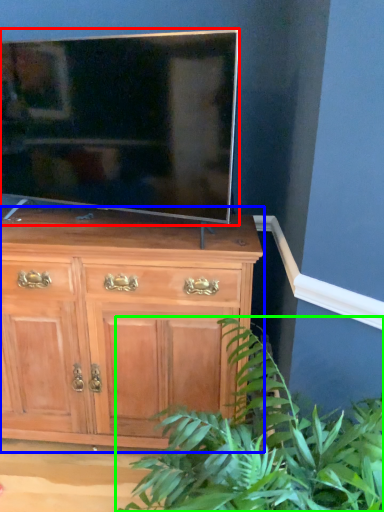
Question: Which object is positioned closest to television (highlighted by a red box)? Select from chest of drawers (highlighted by a blue box) and houseplant (highlighted by a green box).

Choices:
 (A) chest of drawers
 (B) houseplant

Answer: (A)